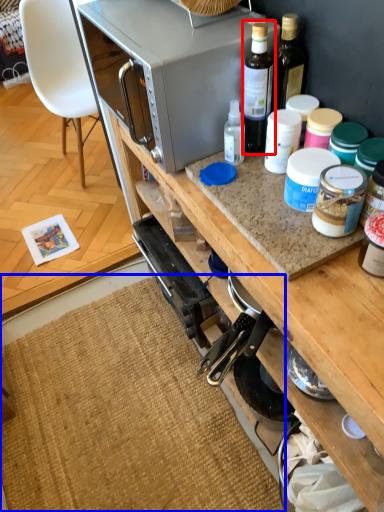
Question: Which object is closer to the camera taking this photo, bottle (highlighted by a red box) or mat (highlighted by a blue box)?

Choices:
 (A) bottle
 (B) mat

Answer: (A)